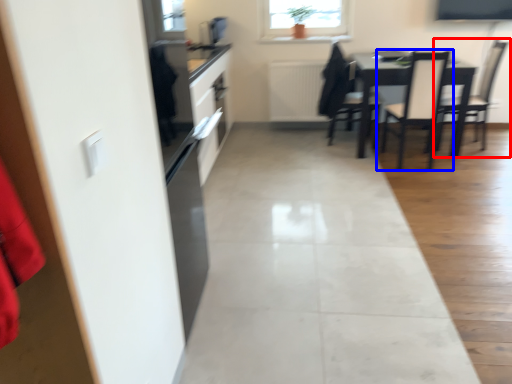
Question: Which object is further to the camera taking this photo, chair (highlighted by a red box) or chair (highlighted by a blue box)?

Choices:
 (A) chair
 (B) chair

Answer: (A)